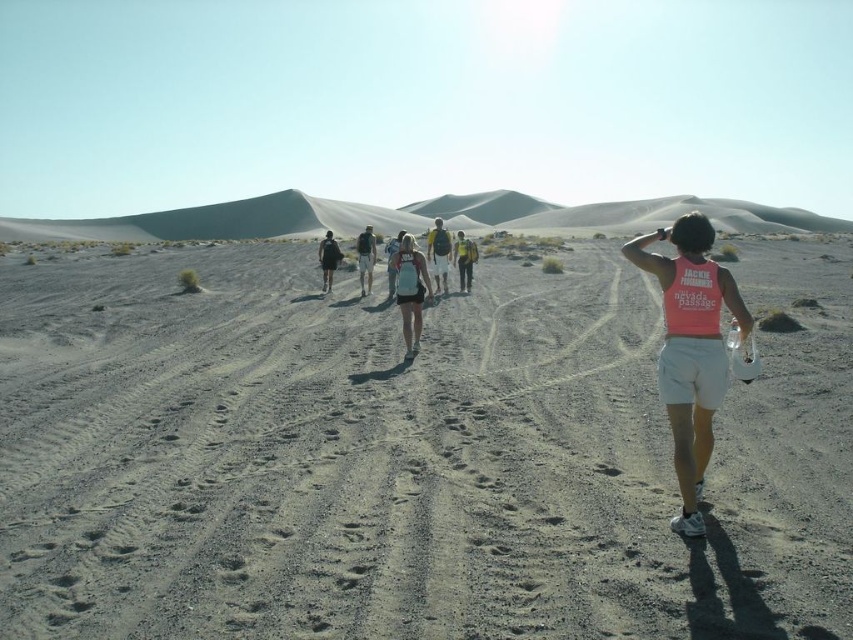
Question: Which of the following is the closest to the observer?

Choices:
 (A) (x=706, y=344)
 (B) (x=444, y=232)
 (C) (x=393, y=284)
 (D) (x=399, y=307)

Answer: (A)

Question: Does light blue fabric backpack at center come in front of pink fabric tank top at center?

Choices:
 (A) no
 (B) yes

Answer: (A)

Question: Is pink fabric tank top at center-right closer to camera compared to yellow fabric backpack at center?

Choices:
 (A) yes
 (B) no

Answer: (A)

Question: Which object is farther from the camera taking this photo?

Choices:
 (A) matte blue tank top at center
 (B) pink fabric tank top at center-right
 (C) pink fabric tank top at center
 (D) black fabric backpack at center

Answer: (D)

Question: Estimate the real-world distances between objects in this image. Which object is closer to the gray sandy dirt track at center?

Choices:
 (A) matte black backpack at center
 (B) light blue fabric backpack at center
 (C) yellow fabric backpack at center
 (D) matte blue tank top at center

Answer: (D)

Question: Is light blue fabric backpack at center thinner than yellow fabric backpack at center?

Choices:
 (A) no
 (B) yes

Answer: (A)